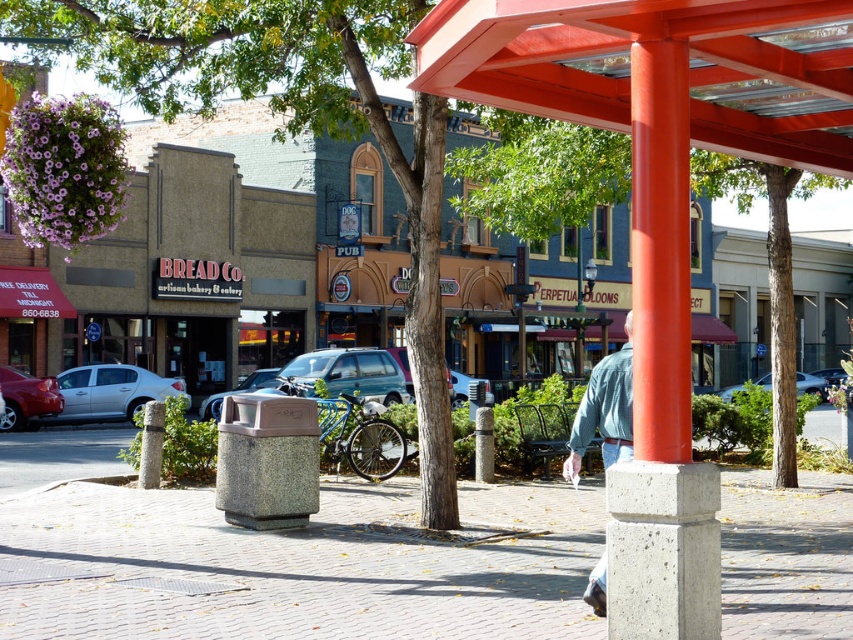
From the picture: You are a delivery driver who needs to park your 2.5 meter wide van. You see the silver metallic sedan at left and the gray concrete post at lower left. Can you fit your van between them?

The silver metallic sedan at left is wider than the gray concrete post at lower left. Since the sedan is wider, the space between them might be sufficient for your 2.5 meter wide van, but you should check the exact distance to ensure safety.